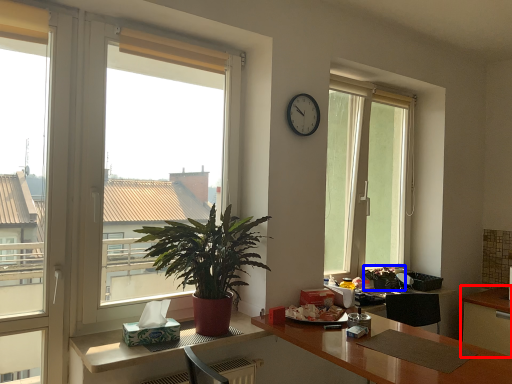
Question: Which point is further to the camera, cabinetry (highlighted by a red box) or houseplant (highlighted by a blue box)?

Choices:
 (A) cabinetry
 (B) houseplant

Answer: (B)